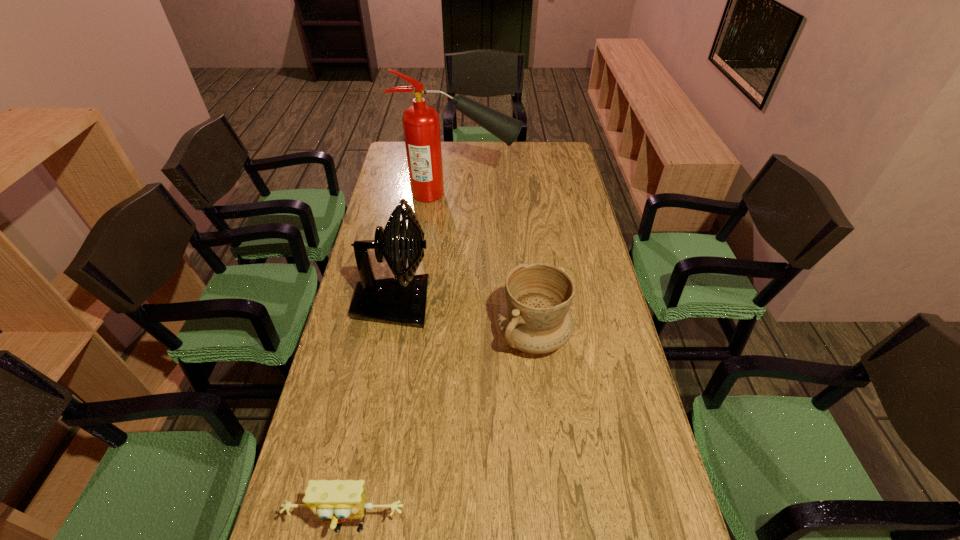
Image resolution: width=960 pixels, height=540 pixels. Identify the location of free space at the far edge of the desktop. (492, 167).

In the image, there is a desktop. Where is `vacant space at the left edge`? This screenshot has height=540, width=960. vacant space at the left edge is located at coordinates (365, 415).

At what (x,y) coordinates should I click in order to perform the action: click on vacant region at the right edge of the desktop. Please return your answer as a coordinate pair (x, y). Image resolution: width=960 pixels, height=540 pixels. Looking at the image, I should click on click(620, 346).

What are the coordinates of `unoccupied area between the second shortest object and the fan` in the screenshot? It's located at (x=464, y=320).

Find the location of a particular element. The height and width of the screenshot is (540, 960). empty space between the second tallest object and the pottery is located at coordinates (464, 320).

This screenshot has width=960, height=540. What are the coordinates of `object that can be found as the third closest to the pottery` in the screenshot? It's located at (421, 126).

Locate which object is the second closest to the fan. Please provide its 2D coordinates. Your answer should be formatted as a tuple, i.e. [(x, y)], where the tuple contains the x and y coordinates of a point satisfying the conditions above.

[(421, 126)]

At what (x,y) coordinates should I click in order to perform the action: click on free location that satisfies the following two spatial constraints: 1. in front of the second shortest object to blow air; 2. on the right side of the third shortest object. Please return your answer as a coordinate pair (x, y). Looking at the image, I should click on (388, 336).

You are a GUI agent. You are given a task and a screenshot of the screen. Output one action in this format:
    pyautogui.click(x=<x>, y=<y>)
    Task: Click on the vacant space that satisfies the following two spatial constraints: 1. on the back side of the third tallest object; 2. in front of the third shortest object to blow air
    This screenshot has height=540, width=960.
    Given the screenshot: What is the action you would take?
    pyautogui.click(x=530, y=303)

Find the location of a particular element. free space that satisfies the following two spatial constraints: 1. in front of the fan to blow air; 2. on the left side of the third tallest object is located at coordinates (388, 336).